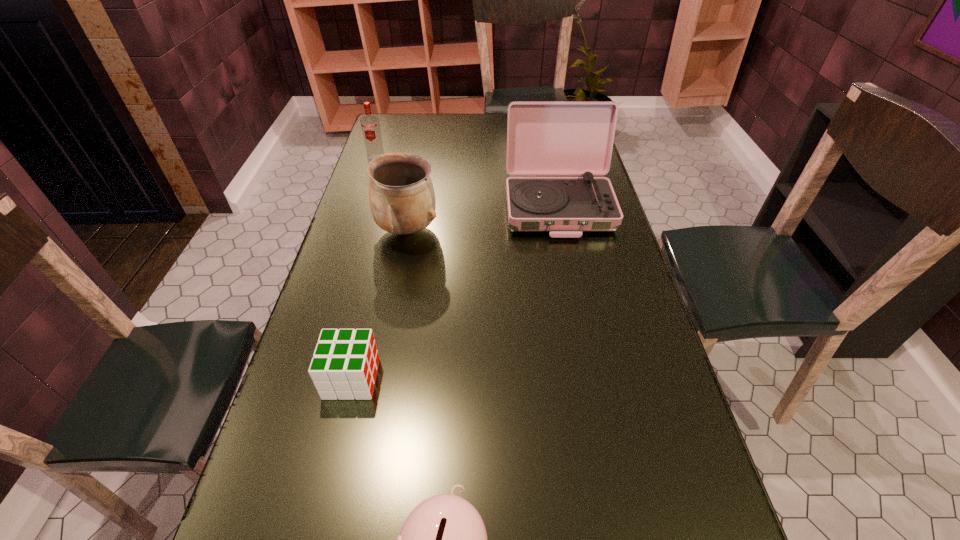
The width and height of the screenshot is (960, 540). I want to click on vacant area that lies between the vodka and the record player, so click(468, 183).

In order to click on free space between the tallest object and the urn in this screenshot , I will do `click(482, 218)`.

Where is `object identified as the closest to the record player`? object identified as the closest to the record player is located at coordinates (402, 199).

Identify the location of object that is the second closest to the nearest object. Image resolution: width=960 pixels, height=540 pixels. (402, 199).

I want to click on free spot that satisfies the following two spatial constraints: 1. on the front label of the farthest object; 2. on the left side of the urn, so click(353, 230).

The image size is (960, 540). Find the location of `blank area in the image that satisfies the following two spatial constraints: 1. on the front label of the farthest object; 2. on the left side of the urn`. blank area in the image that satisfies the following two spatial constraints: 1. on the front label of the farthest object; 2. on the left side of the urn is located at coordinates (353, 230).